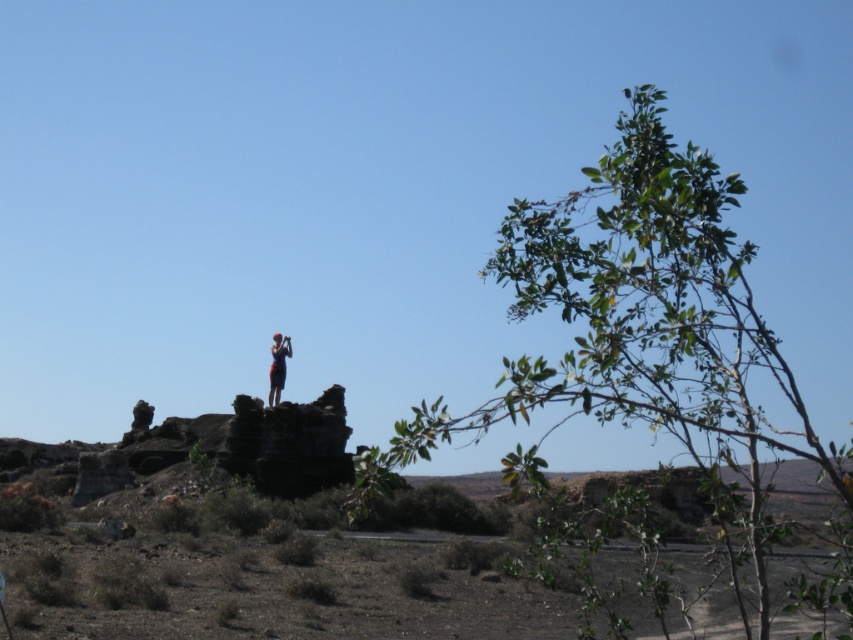
Question: Which object appears closest to the camera in this image?

Choices:
 (A) green leafy tree at upper right
 (B) red fabric person at center

Answer: (A)

Question: Is green leafy tree at upper right thinner than red fabric person at center?

Choices:
 (A) yes
 (B) no

Answer: (B)

Question: Which object is closer to the camera taking this photo?

Choices:
 (A) red fabric person at center
 (B) green leafy tree at upper right

Answer: (B)

Question: Considering the relative positions of green leafy tree at upper right and red fabric person at center in the image provided, where is green leafy tree at upper right located with respect to red fabric person at center?

Choices:
 (A) above
 (B) below

Answer: (B)

Question: Does green leafy tree at upper right come in front of red fabric person at center?

Choices:
 (A) yes
 (B) no

Answer: (A)